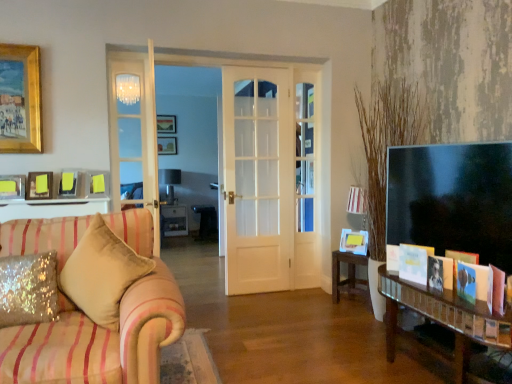
The width and height of the screenshot is (512, 384). What are the coordinates of `free space in front of wooden table at center, arranged as the 1th table when viewed from the front` in the screenshot? It's located at (352, 319).